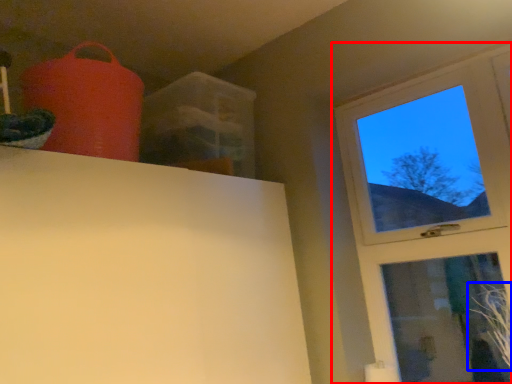
Question: Which object appears closest to the camera in this image, window (highlighted by a red box) or plant (highlighted by a blue box)?

Choices:
 (A) window
 (B) plant

Answer: (B)